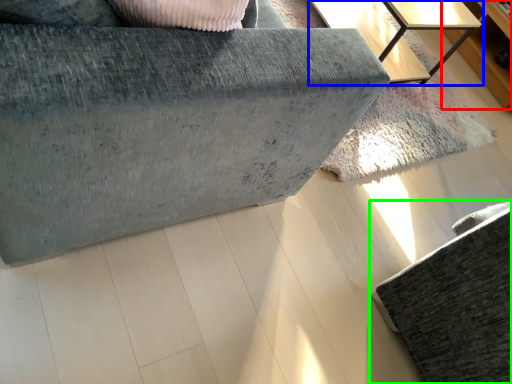
Question: Considering the real-world distances, which object is farthest from dresser (highlighted by a red box)? table (highlighted by a blue box) or furniture (highlighted by a green box)?

Choices:
 (A) table
 (B) furniture

Answer: (B)